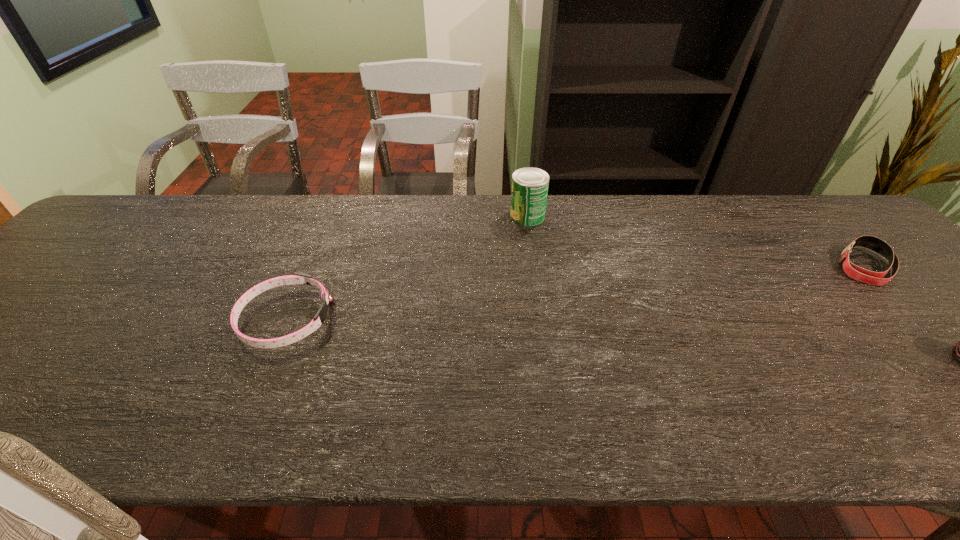
Locate an element on the screen. Image resolution: width=960 pixels, height=540 pixels. can is located at coordinates click(530, 185).

This screenshot has height=540, width=960. I want to click on the farthest object, so click(x=530, y=185).

At what (x,y) coordinates should I click in order to perform the action: click on the leftmost object. Please return your answer as a coordinate pair (x, y). The height and width of the screenshot is (540, 960). Looking at the image, I should click on (297, 278).

I want to click on the left dog collar, so click(297, 278).

Identify the location of the right dog collar. The width and height of the screenshot is (960, 540). (857, 273).

Locate an element on the screen. Image resolution: width=960 pixels, height=540 pixels. the second farthest object is located at coordinates (857, 273).

Where is `free location located 0.350m on the front of the second object from left to right`? This screenshot has width=960, height=540. free location located 0.350m on the front of the second object from left to right is located at coordinates (541, 316).

What are the coordinates of `free space located with the buckle on the nearest object` in the screenshot? It's located at (377, 320).

Find the location of a particular element. This screenshot has width=960, height=540. free space located 0.250m on the left of the farther dog collar is located at coordinates (741, 266).

At what (x,y) coordinates should I click in order to perform the action: click on object that is at the far edge. Please return your answer as a coordinate pair (x, y). This screenshot has height=540, width=960. Looking at the image, I should click on (530, 185).